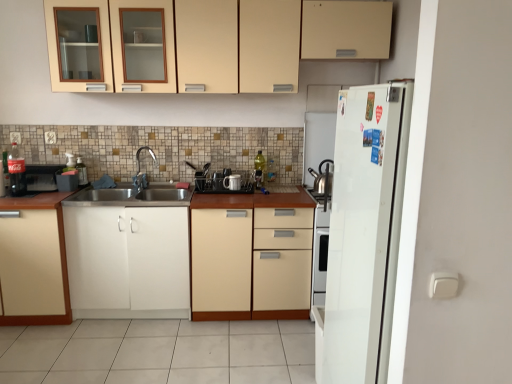
Locate an element on the screen. free space to the left of white glossy mug at center, which is the 2th appliance in right-to-left order is located at coordinates (207, 193).